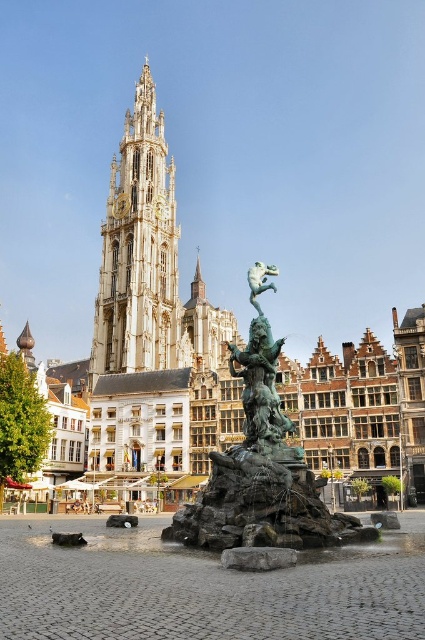
You are an architect visiting the town square and want to install a new light post that must be shorter than the bronze statue at center. Can you confirm if the light post will also be shorter than the white stone tower at center?

The bronze statue at center is shorter than the white stone tower at center. Since the light post is shorter than the bronze statue at center, it will also be shorter than the white stone tower at center.